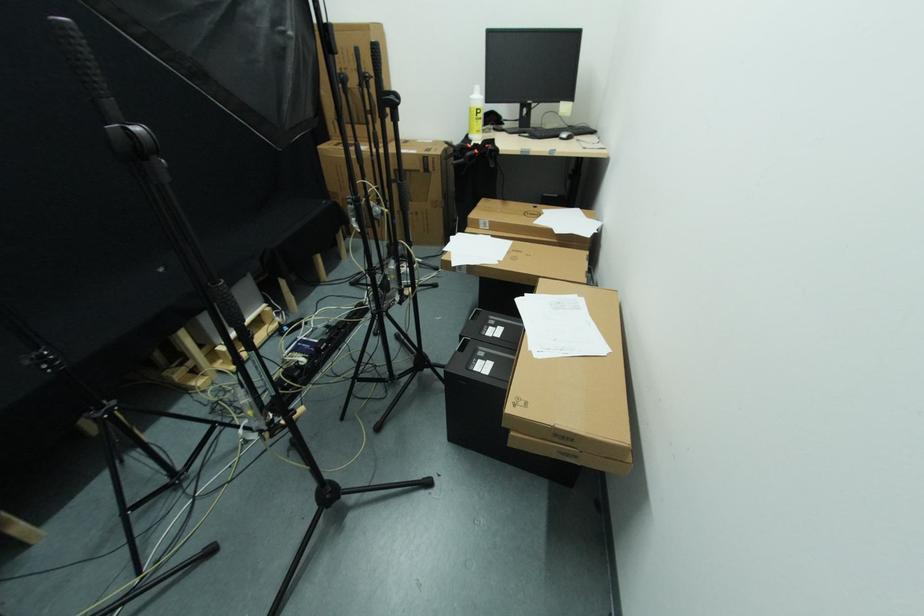
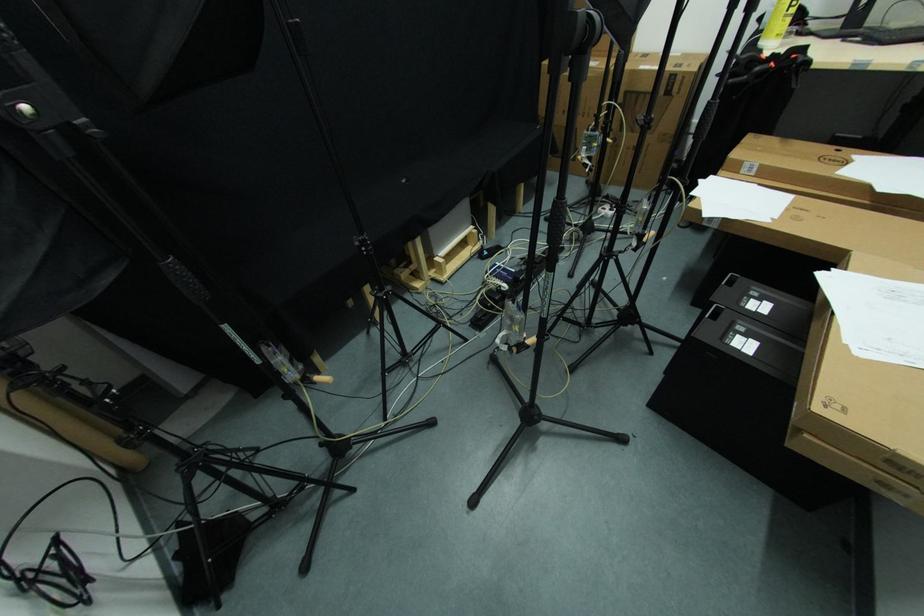
Locate, in the second image, the point that corresponds to [481,114] in the first image.

(796, 6)